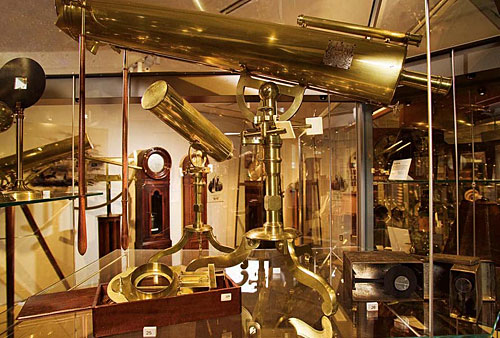
This screenshot has height=338, width=500. What are the coordinates of `display glass case` in the screenshot? It's located at (424, 38), (165, 225), (52, 261).